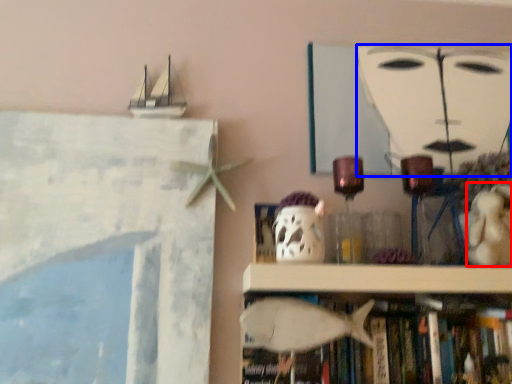
Question: Among these objects, which one is farthest to the camera, toy (highlighted by a red box) or human face (highlighted by a blue box)?

Choices:
 (A) toy
 (B) human face

Answer: (B)